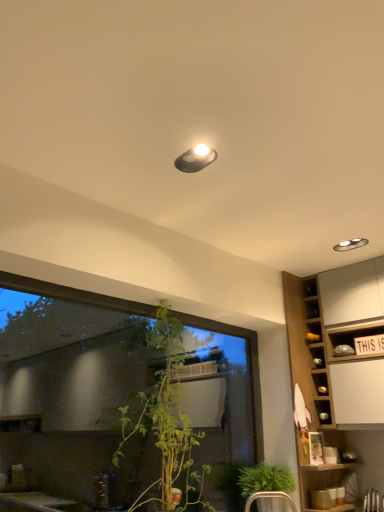
What are the coordinates of `transparent glass window at center` in the screenshot? It's located at (248, 368).

What are the coordinates of `wooden cabinet at right` in the screenshot? It's located at (335, 346).

At what (x,y) coordinates should I click in order to perform the action: click on metallic silver armchair at lower center. Please return your answer as a coordinate pair (x, y). Looking at the image, I should click on (271, 502).

Considering the points (344, 443) and (286, 501), which point is behind, point (344, 443) or point (286, 501)?

The point (344, 443) is behind.

From the image's perspective, is wooden cabinet at right on top of metallic silver armchair at lower center?

Yes.

The image size is (384, 512). What are the coordinates of `cabinetry above the metallic silver armchair at lower center (from a real-world perspective)` in the screenshot? It's located at (335, 346).

Who is shorter, wooden cabinet at right or metallic silver armchair at lower center?

With less height is metallic silver armchair at lower center.

Can you confirm if metallic silver armchair at lower center is smaller than wooden cabinet at right?

Indeed, metallic silver armchair at lower center has a smaller size compared to wooden cabinet at right.

Looking at this image, between metallic silver armchair at lower center and wooden cabinet at right, which one is positioned in front?

Positioned in front is metallic silver armchair at lower center.

Is metallic silver armchair at lower center next to wooden cabinet at right and touching it?

No, metallic silver armchair at lower center is not touching wooden cabinet at right.

Identify the location of armchair below the wooden cabinet at right (from the image's perspective). This screenshot has width=384, height=512. (271, 502).

Visually, is transparent glass window at center positioned to the left or to the right of wooden cabinet at right?

Based on their positions, transparent glass window at center is located to the left of wooden cabinet at right.

Is transparent glass window at center looking in the opposite direction of wooden cabinet at right?

No, transparent glass window at center is not facing away from wooden cabinet at right.

From the image's perspective, relative to wooden cabinet at right, is transparent glass window at center above or below?

From the image's perspective, transparent glass window at center appears above wooden cabinet at right.

Considering the relative sizes of transparent glass window at center and wooden cabinet at right in the image provided, is transparent glass window at center smaller than wooden cabinet at right?

Correct, transparent glass window at center occupies less space than wooden cabinet at right.

Between wooden cabinet at right and green leafy plant at lower center, which one has more height?

wooden cabinet at right.

Between wooden cabinet at right and green leafy plant at lower center, which one is positioned in front?

green leafy plant at lower center is in front.

Looking at this image, which point is more distant from viewer, [378,393] or [242,471]?

The point [242,471] is behind.

Where is `window on the left of green leafy plant at lower center`? window on the left of green leafy plant at lower center is located at coordinates (248, 368).

From the picture: Is transparent glass window at center completely or partially inside green leafy plant at lower center?

No, transparent glass window at center is not inside green leafy plant at lower center.

From a real-world perspective, which object rests below the other?

green leafy plant at lower center, from a real-world perspective.

Is green leafy plant at lower center bigger than transparent glass window at center?

Actually, green leafy plant at lower center might be smaller than transparent glass window at center.

Measure the distance between metallic silver armchair at lower center and transparent glass window at center.

metallic silver armchair at lower center is 29.38 inches away from transparent glass window at center.

In the image, there is a transparent glass window at center. Find the location of `armchair below it (from a real-world perspective)`. armchair below it (from a real-world perspective) is located at coordinates (271, 502).

Based on their sizes in the image, would you say metallic silver armchair at lower center is bigger or smaller than transparent glass window at center?

Considering their sizes, metallic silver armchair at lower center takes up less space than transparent glass window at center.

How distant is green leafy plant at lower center from matte black light fixture at upper center?

They are 5.36 feet apart.

Considering the sizes of green leafy plant at lower center and matte black light fixture at upper center in the image, is green leafy plant at lower center wider or thinner than matte black light fixture at upper center?

In the image, green leafy plant at lower center appears to be wider than matte black light fixture at upper center.

Could you tell me if green leafy plant at lower center is facing matte black light fixture at upper center?

No.

Looking at this image, from a real-world perspective, does green leafy plant at lower center sit lower than matte black light fixture at upper center?

Yes, from a real-world perspective, green leafy plant at lower center is beneath matte black light fixture at upper center.

You are a GUI agent. You are given a task and a screenshot of the screen. Output one action in this format:
    pyautogui.click(x=<x>, y=<y>)
    Task: Click on the armchair located below the wooden cabinet at right (from the image's perspective)
    The height and width of the screenshot is (512, 384).
    Given the screenshot: What is the action you would take?
    pyautogui.click(x=271, y=502)

The image size is (384, 512). Find the location of `cabinetry above the metallic silver armchair at lower center (from a real-world perspective)`. cabinetry above the metallic silver armchair at lower center (from a real-world perspective) is located at coordinates (335, 346).

Considering their positions, is green leafy plant at lower center positioned closer to matte black light fixture at upper center than metallic silver armchair at lower center?

Based on the image, metallic silver armchair at lower center appears to be nearer to matte black light fixture at upper center.

When comparing their distances from matte black light fixture at upper center, does wooden cabinet at right or green leafy plant at lower center seem further?

Based on the image, green leafy plant at lower center appears to be further to matte black light fixture at upper center.

Estimate the real-world distances between objects in this image. Which object is closer to matte black light fixture at upper center, green leafy plant at lower center or wooden cabinet at right?

Among the two, wooden cabinet at right is located nearer to matte black light fixture at upper center.

Based on the photo, which object lies further to the anchor point green leafy plant at lower center, transparent glass window at center or matte black light fixture at upper center?

matte black light fixture at upper center is further to green leafy plant at lower center.

Based on their spatial positions, is wooden cabinet at right or green leafy plant at lower center closer to metallic silver armchair at lower center?

green leafy plant at lower center.

Looking at the image, which one is located further to metallic silver armchair at lower center, matte black light fixture at upper center or wooden cabinet at right?

Among the two, matte black light fixture at upper center is located further to metallic silver armchair at lower center.

Looking at the image, which one is located closer to metallic silver armchair at lower center, transparent glass window at center or green leafy plant at lower center?

The object closer to metallic silver armchair at lower center is green leafy plant at lower center.

When comparing their distances from metallic silver armchair at lower center, does green leafy plant at lower center or matte black light fixture at upper center seem further?

The object further to metallic silver armchair at lower center is matte black light fixture at upper center.

What are the coordinates of `armchair between transparent glass window at center and green leafy plant at lower center along the z-axis` in the screenshot? It's located at (271, 502).

The width and height of the screenshot is (384, 512). I want to click on houseplant located between metallic silver armchair at lower center and wooden cabinet at right in the left-right direction, so click(267, 485).

Find the location of a particular element. This screenshot has height=512, width=384. cabinetry between matte black light fixture at upper center and metallic silver armchair at lower center in the up-down direction is located at coordinates (335, 346).

Where is `window between matte black light fixture at upper center and wooden cabinet at right in the vertical direction`? window between matte black light fixture at upper center and wooden cabinet at right in the vertical direction is located at coordinates (248, 368).